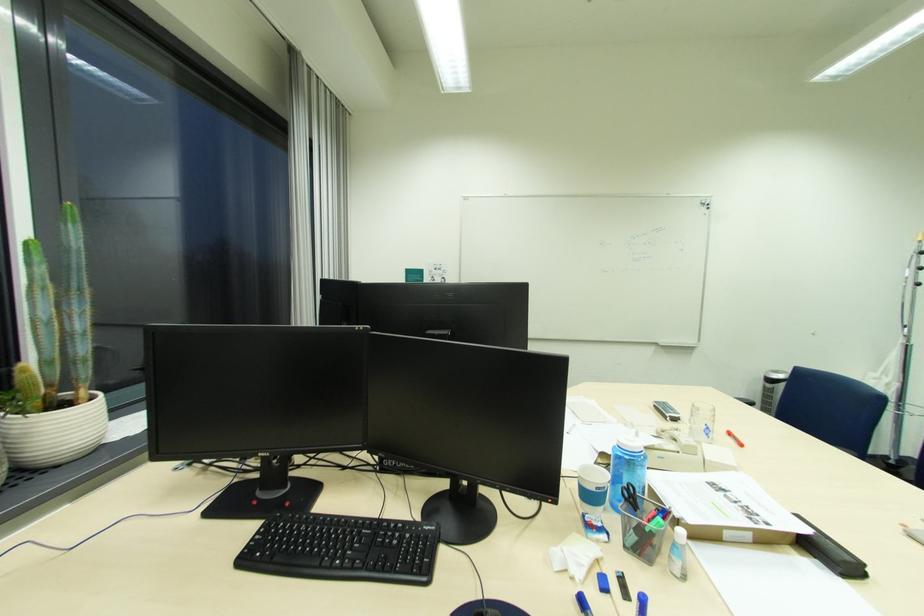
Describe the element at coordinates (641, 604) in the screenshot. I see `the blue bottle cap` at that location.